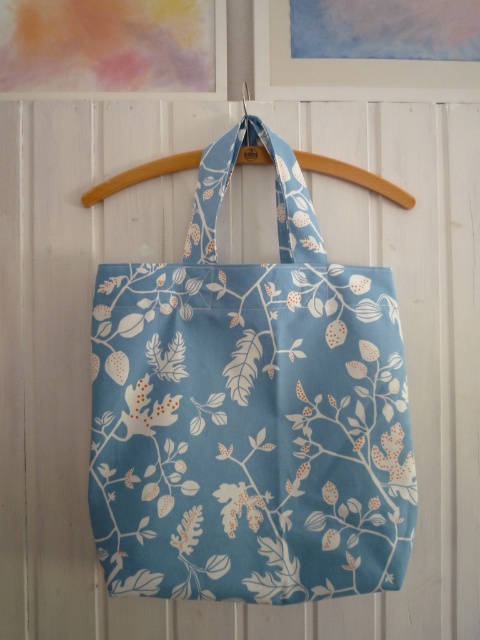
I want to click on light blue fabric tote at center, so click(250, 412).

Can you confirm if light blue fabric tote at center is wider than wooden hanger at center?

In fact, light blue fabric tote at center might be narrower than wooden hanger at center.

Does point (117, 348) lie in front of point (181, 164)?

That is True.

Identify the location of light blue fabric tote at center. The image size is (480, 640). (250, 412).